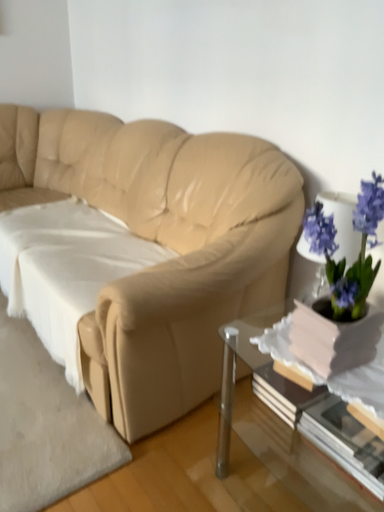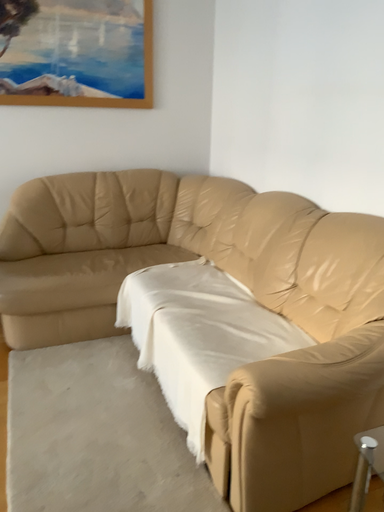
Question: Which way did the camera rotate in the video?

Choices:
 (A) rotated right
 (B) rotated left

Answer: (B)